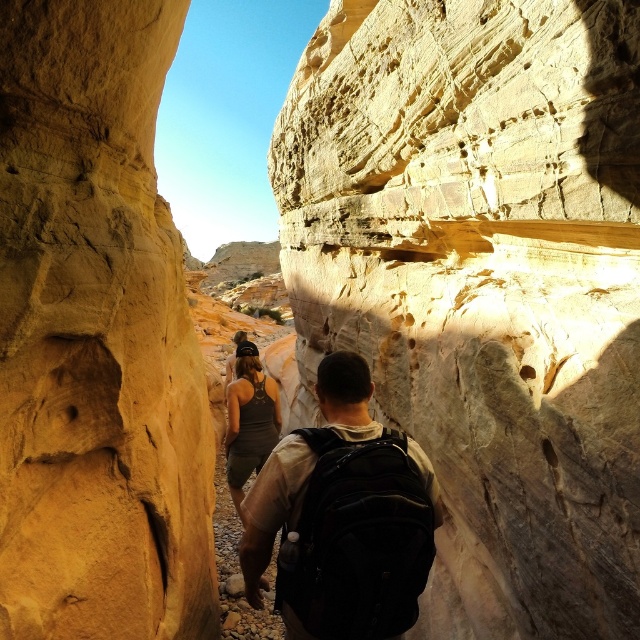
Question: Among these points, which one is farthest from the camera?

Choices:
 (A) (353, 369)
 (B) (476, 611)

Answer: (B)

Question: Which object is farther from the camera taking this photo?

Choices:
 (A) matte sandstone rock face at center
 (B) matte yellow rock at left
 (C) matte black backpack at center

Answer: (A)

Question: Is matte yellow rock at left thinner than matte black backpack at center?

Choices:
 (A) yes
 (B) no

Answer: (A)

Question: Can you confirm if matte sandstone rock face at center is wider than matte black backpack at center?

Choices:
 (A) yes
 (B) no

Answer: (A)

Question: Is matte yellow rock at left thinner than matte black backpack at center?

Choices:
 (A) no
 (B) yes

Answer: (B)

Question: Estimate the real-world distances between objects in this image. Which object is farther from the matte yellow rock at left?

Choices:
 (A) matte black backpack at center
 (B) matte sandstone rock face at center

Answer: (B)